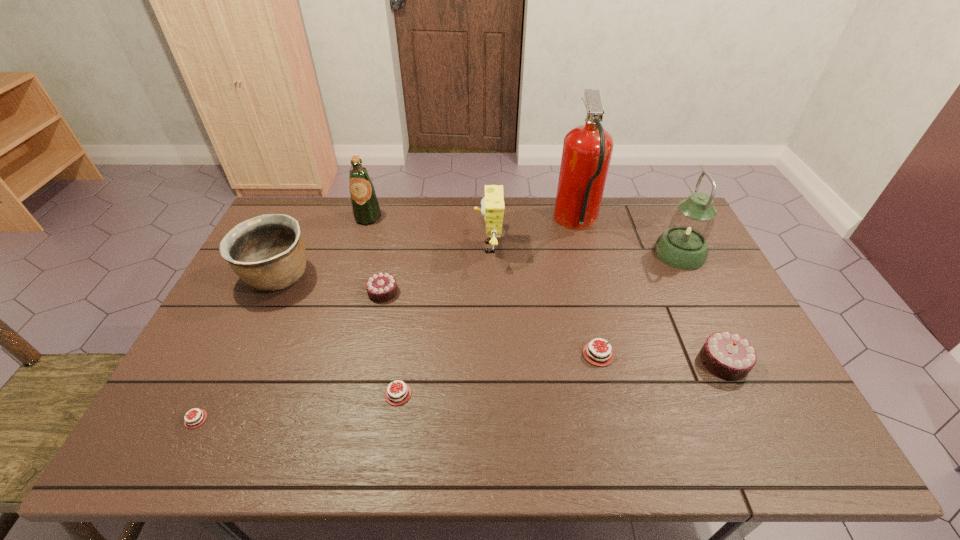
You are a GUI agent. You are given a task and a screenshot of the screen. Output one action in this format:
    pyautogui.click(x=<x>, y=<y>)
    Task: Click on the vacant space positioned on the right of the eighth tallest object
    
    Given the screenshot: What is the action you would take?
    pyautogui.click(x=691, y=354)

Find the location of a particular element. free space located 0.100m on the left of the second biggest red chocolate cake is located at coordinates (324, 394).

Find the location of a particular element. The height and width of the screenshot is (540, 960). free spot located 0.320m on the back of the shortest object is located at coordinates (256, 299).

Image resolution: width=960 pixels, height=540 pixels. In order to click on fire extinguisher that is at the far edge in this screenshot , I will do `click(587, 149)`.

At what (x,y) coordinates should I click in order to perform the action: click on lantern that is at the far edge. Please return your answer as a coordinate pair (x, y). Looking at the image, I should click on (683, 245).

Find the location of a particular element. The width and height of the screenshot is (960, 540). olive oil located at the far edge is located at coordinates (365, 206).

The width and height of the screenshot is (960, 540). I want to click on sponge situated at the far edge, so click(492, 209).

You are a GUI agent. You are given a task and a screenshot of the screen. Output one action in this format:
    pyautogui.click(x=<x>, y=<y>)
    Task: Click on the pottery that is at the left edge
    
    Given the screenshot: What is the action you would take?
    pyautogui.click(x=267, y=252)

Find the location of a particular element. The height and width of the screenshot is (540, 960). chocolate cake at the left edge is located at coordinates (188, 423).

Identify the location of lantern that is at the right edge. (683, 245).